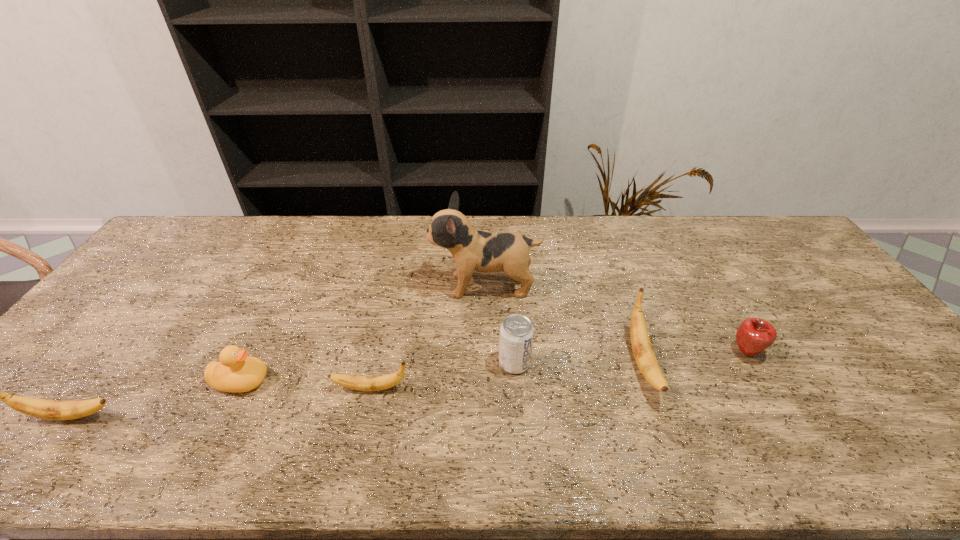
Find the location of a particular element. Image resolution: width=960 pixels, height=540 pixels. duck positioned at the near edge is located at coordinates (236, 372).

Locate an element on the screen. object located at the left edge is located at coordinates (41, 408).

Where is `object that is at the near left corner`? object that is at the near left corner is located at coordinates (41, 408).

The image size is (960, 540). What are the coordinates of `blank space at the far edge of the desktop` in the screenshot? It's located at (341, 234).

Find the location of a particular element. Image resolution: width=960 pixels, height=540 pixels. vacant space at the near edge of the desktop is located at coordinates (666, 395).

Locate an element on the screen. This screenshot has height=540, width=960. free space at the right edge is located at coordinates (837, 307).

The height and width of the screenshot is (540, 960). I want to click on empty space between the second object from left to right and the second object from right to left, so click(442, 372).

Where is `free area in between the leftmost banana and the second object from left to right`? free area in between the leftmost banana and the second object from left to right is located at coordinates (156, 399).

At what (x,y) coordinates should I click in order to perform the action: click on free point between the second shortest banana and the tallest object. Please return your answer as a coordinate pair (x, y). Looking at the image, I should click on (277, 351).

Find the location of a particular element. The image size is (960, 540). free space between the tallest object and the rightmost object is located at coordinates (615, 319).